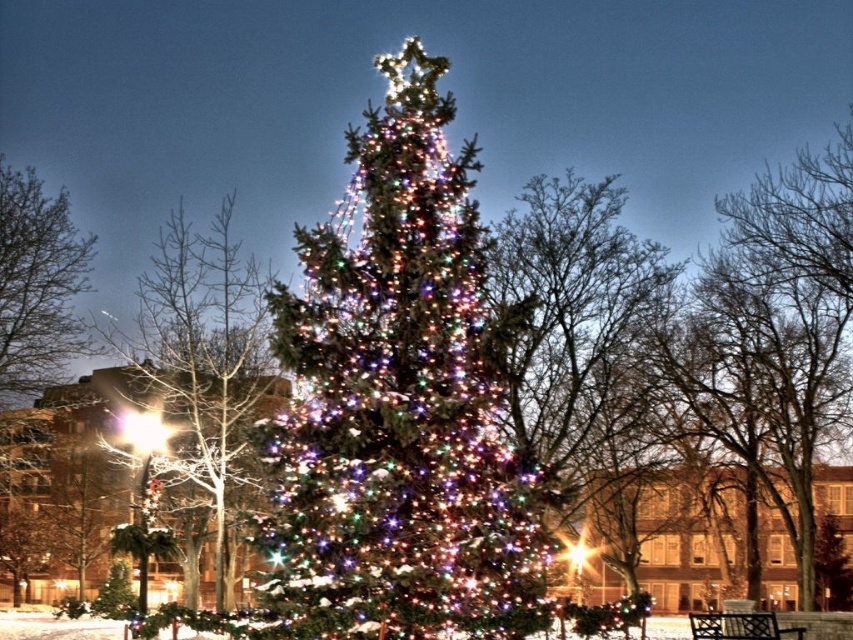
Looking at this image, you are standing in front of the festive Christmas tree scene. There is a point marked at coordinates point [347,502]. Can you estimate how far this point is from your current position?

The point [347,502] is 16.16 meters away from the viewer.

You are standing in front of the Christmas tree and want to place a decoration. You have two points marked on the tree where you can hang it. The first point is at coordinates point (228, 358) and the second is at point (55, 326). Which point is closer to you?

Point (228, 358) is closer to the viewer than point (55, 326).